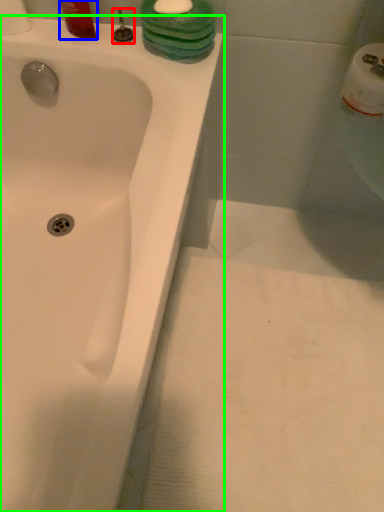
Question: Estimate the real-world distances between objects in this image. Which object is farther from plumbing fixture (highlighted by a red box), liquid (highlighted by a blue box) or bathtub (highlighted by a green box)?

Choices:
 (A) liquid
 (B) bathtub

Answer: (B)